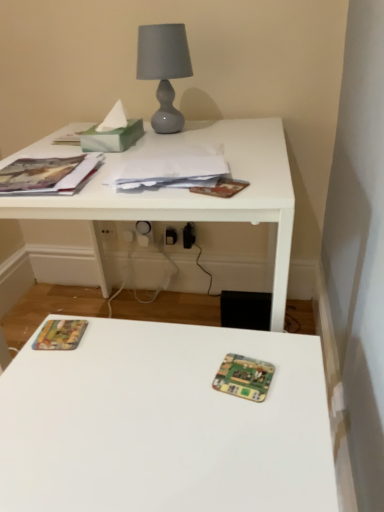
Identify the location of vacant area that is situated to the right of matte gray glass table lamp at upper center. (221, 122).